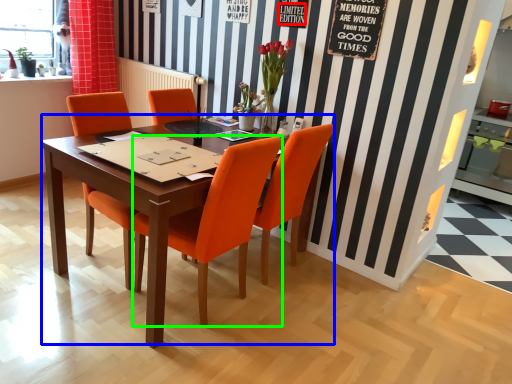
Question: Estimate the real-world distances between objects in this image. Which object is farther from writing (highlighted by a red box), kitchen & dining room table (highlighted by a blue box) or chair (highlighted by a green box)?

Choices:
 (A) kitchen & dining room table
 (B) chair

Answer: (A)